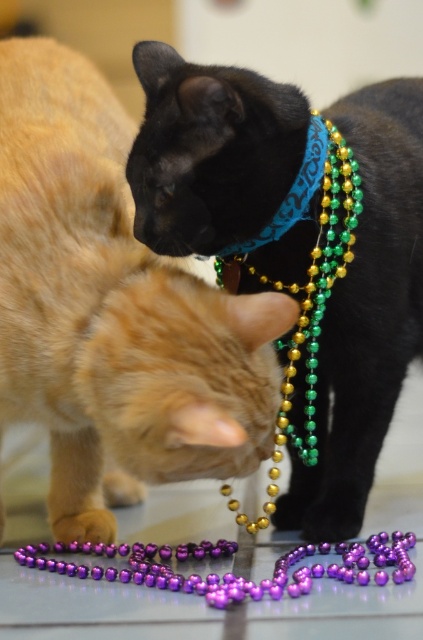
From the picture: You are a photographer standing 4 feet away from the green metallic beads at center. You want to take a photo of them. Do you need to move closer or farther away to ensure they are in focus?

The green metallic beads at center are 3.83 feet away from the camera. Since you are currently 4 feet away, you need to move 0.17 feet closer to match the focus distance.

You are a photographer trying to capture a clear shot of both the green metallic beads at center and the blue fabric neckband at upper center. Based on their positions, which object should you focus on first to ensure both are in focus?

The green metallic beads at center is below blue fabric neckband at upper center. To ensure both are in focus, you should focus on the blue fabric neckband at upper center first since it is closer to the camera, and the beads are further away. This way, the depth of field will cover both objects.